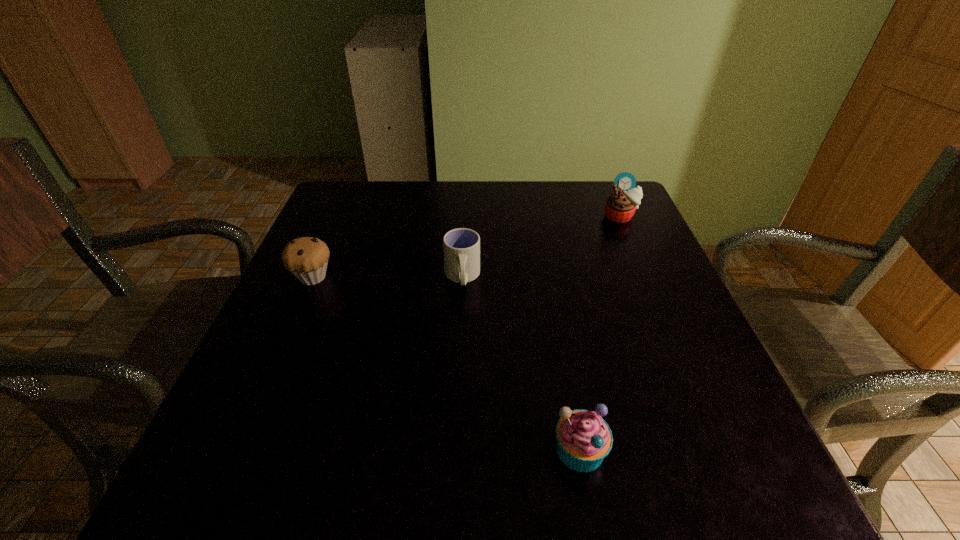
You are a GUI agent. You are given a task and a screenshot of the screen. Output one action in this format:
    pyautogui.click(x=<x>, y=<y>)
    Task: Click on the free region located 0.110m on the back of the second muffin from right to left
    
    Given the screenshot: What is the action you would take?
    [565, 367]

Find the location of `object that is at the far edge`. object that is at the far edge is located at coordinates (620, 206).

The width and height of the screenshot is (960, 540). I want to click on object that is at the near edge, so click(x=583, y=438).

Locate an element on the screen. object at the left edge is located at coordinates (306, 258).

Find the location of a particular element. object that is positioned at the right edge is located at coordinates (620, 206).

You are a GUI agent. You are given a task and a screenshot of the screen. Output one action in this format:
    pyautogui.click(x=<x>, y=<y>)
    Task: Click on the object at the far right corner
    The image size is (960, 540).
    Given the screenshot: What is the action you would take?
    pyautogui.click(x=620, y=206)

In the image, there is a desktop. What are the coordinates of `vacant space at the far edge` in the screenshot? It's located at (574, 224).

Identify the location of free location at the left edge. (348, 301).

This screenshot has width=960, height=540. Find the location of `free spot at the right edge of the desktop`. free spot at the right edge of the desktop is located at coordinates (695, 406).

Where is `free spot at the near left corner of the desktop`? The image size is (960, 540). free spot at the near left corner of the desktop is located at coordinates point(197,454).